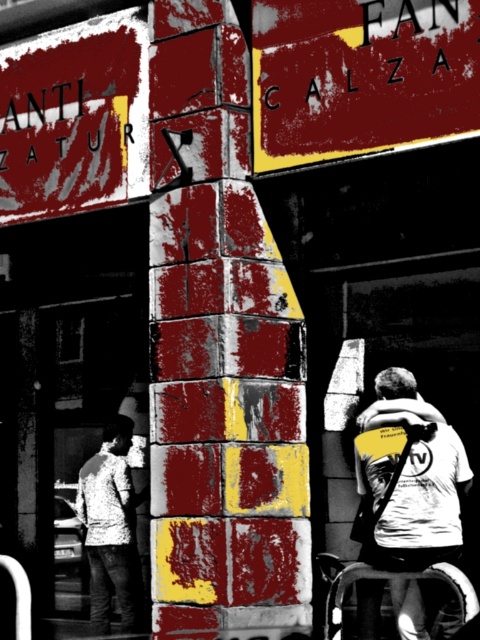
Between rusty metal sign at upper left and white matte t-shirt at lower right, which one is positioned lower?

white matte t-shirt at lower right

Is rusty metal sign at upper left further to camera compared to white matte t-shirt at lower right?

Yes.

The height and width of the screenshot is (640, 480). I want to click on rusty metal sign at upper left, so click(74, 118).

Which is more to the left, rusty metal sign at upper left or white plastic cart at lower right?

rusty metal sign at upper left is more to the left.

Who is lower down, rusty metal sign at upper left or white plastic cart at lower right?

white plastic cart at lower right

You are a GUI agent. You are given a task and a screenshot of the screen. Output one action in this format:
    pyautogui.click(x=<x>, y=<y>)
    Task: Click on the rusty metal sign at upper left
    
    Given the screenshot: What is the action you would take?
    pyautogui.click(x=74, y=118)

Find the location of a particular element. rusty metal sign at upper left is located at coordinates (74, 118).

Measure the distance between white matte t-shirt at lower right and white plastic cart at lower right.

white matte t-shirt at lower right is 16.83 inches away from white plastic cart at lower right.

Who is positioned more to the left, white matte t-shirt at lower right or white plastic cart at lower right?

From the viewer's perspective, white plastic cart at lower right appears more on the left side.

Where is `white matte t-shirt at lower right`? This screenshot has width=480, height=640. white matte t-shirt at lower right is located at coordinates (418, 480).